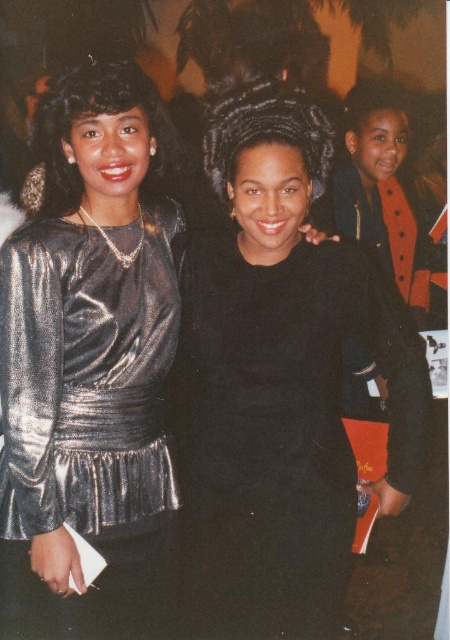
You are a photographer at the event and need to adjust the lighting to ensure both the metallic silver dress at center and the shiny metallic dress at left are equally highlighted. Based on their positions, which dress is closer to the main light source?

The metallic silver dress at center is closer to the main light source because it is positioned to the left of the shiny metallic dress at left, which might be farther away from the light source.

Looking at this image, you are a photographer at a formal event. You need to adjust the lighting to ensure both the black matte dress at center and the shiny metallic dress at left are visible. Which dress might require more careful lighting adjustments due to its reflective surface?

The shiny metallic dress at left requires more careful lighting adjustments because it has a reflective surface that can create glare or hotspots if not properly lit.